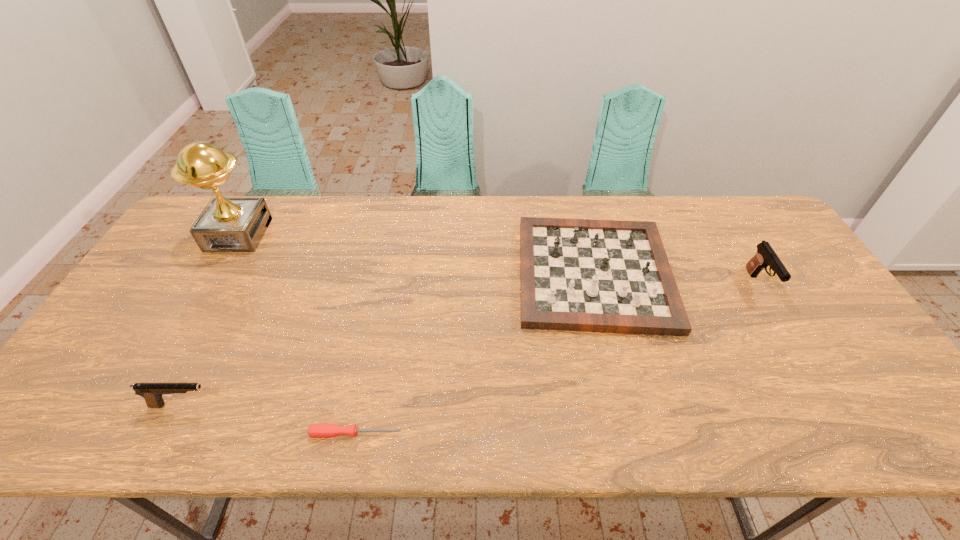
At what (x,y) coordinates should I click in order to perform the action: click on vacant area at the far edge of the desktop. Please return your answer as a coordinate pair (x, y). This screenshot has width=960, height=540. Looking at the image, I should click on (691, 213).

What are the coordinates of `vacant area at the near edge` in the screenshot? It's located at (x=659, y=440).

The width and height of the screenshot is (960, 540). What are the coordinates of `vacant region at the left edge of the desktop` in the screenshot? It's located at (186, 258).

Find the location of a particular element. This screenshot has width=960, height=540. free space at the right edge is located at coordinates (800, 328).

Locate an element on the screen. The width and height of the screenshot is (960, 540). free area in between the chessboard and the rightmost object is located at coordinates coord(676,279).

Find the location of a particular element. The width and height of the screenshot is (960, 540). free space between the second object from right to left and the fourth farthest object is located at coordinates (389, 339).

At what (x,y) coordinates should I click in order to perform the action: click on free point between the shortest object and the nearer pistol. Please return your answer as a coordinate pair (x, y). Image resolution: width=960 pixels, height=540 pixels. Looking at the image, I should click on (270, 419).

Locate an element on the screen. The width and height of the screenshot is (960, 540). vacant space that's between the chessboard and the rightmost object is located at coordinates (676, 279).

You are a GUI agent. You are given a task and a screenshot of the screen. Output one action in this format:
    pyautogui.click(x=<x>, y=<y>)
    Task: Click on the empty space between the fourth object from left to right and the shortest object
    
    Given the screenshot: What is the action you would take?
    pyautogui.click(x=475, y=354)

In order to click on unoccupied position between the farther pistol and the third object from left to right in this screenshot , I will do point(557,359).